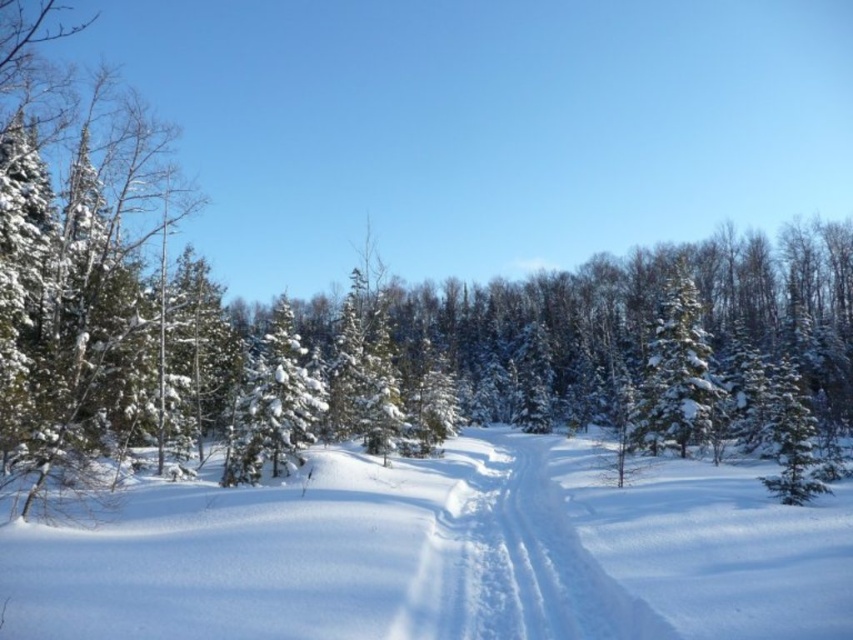
Question: Can you confirm if white fluffy snow at center is positioned below white snow-covered tree at center-right?

Choices:
 (A) yes
 (B) no

Answer: (A)

Question: Which object is the farthest from the white powdery snow trail at center?

Choices:
 (A) white snow-covered tree at center-right
 (B) white fluffy snow at center

Answer: (A)

Question: Estimate the real-world distances between objects in this image. Which object is farther from the white fluffy snow at center?

Choices:
 (A) white powdery snow trail at center
 (B) white snow-covered tree at center-right

Answer: (B)

Question: Is white fluffy snow at center closer to the viewer compared to white snow-covered tree at center-right?

Choices:
 (A) yes
 (B) no

Answer: (A)

Question: Which point is farther to the camera?

Choices:
 (A) (547, 518)
 (B) (637, 419)

Answer: (B)

Question: Can you confirm if white fluffy snow at center is positioned to the right of white powdery snow trail at center?

Choices:
 (A) no
 (B) yes

Answer: (A)